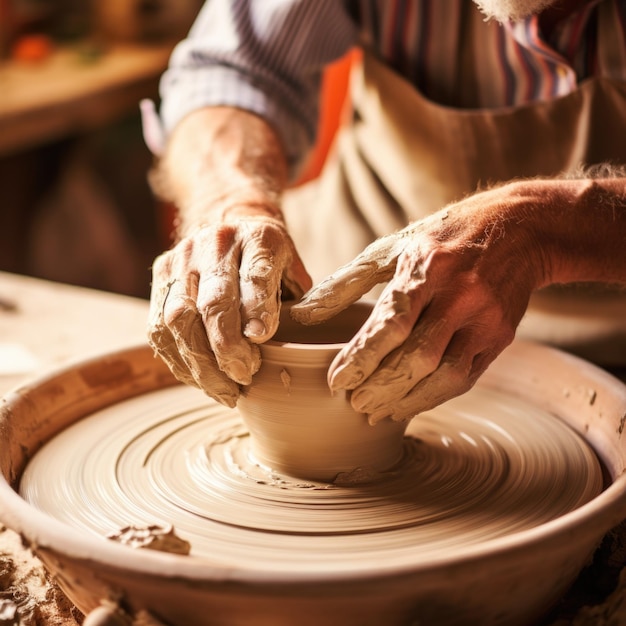
This screenshot has width=626, height=626. Find the location of `bowl`. bowl is located at coordinates (312, 377).